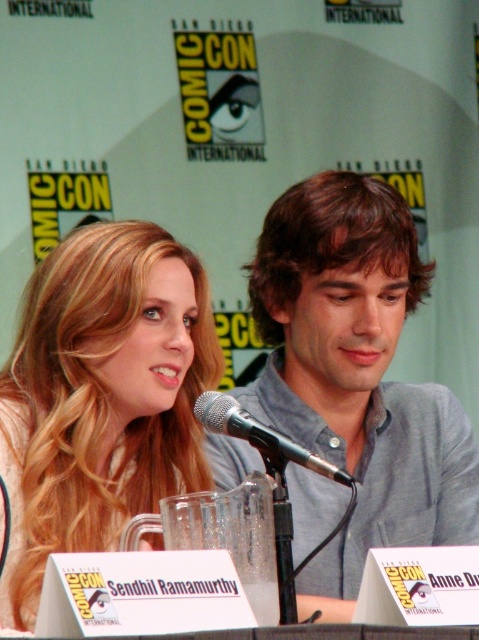
Which is more to the left, blonde hair at upper left or silver metallic microphone at center?

Positioned to the left is blonde hair at upper left.

Does point (52, 538) come closer to viewer compared to point (314, 458)?

That is False.

Locate an element on the screen. blonde hair at upper left is located at coordinates (101, 396).

Does gray cotton shirt at center appear over silver metallic microphone at center?

Yes.

Can you confirm if gray cotton shirt at center is thinner than silver metallic microphone at center?

No, gray cotton shirt at center is not thinner than silver metallic microphone at center.

Is point (390, 244) less distant than point (219, 417)?

No, (390, 244) is behind (219, 417).

Identify the location of gray cotton shirt at center. (356, 376).

Based on the photo, does gray cotton shirt at center have a greater height compared to blonde hair at upper left?

Yes, gray cotton shirt at center is taller than blonde hair at upper left.

Is gray cotton shirt at center to the left of blonde hair at upper left from the viewer's perspective?

No, gray cotton shirt at center is not to the left of blonde hair at upper left.

Identify the location of gray cotton shirt at center. (356, 376).

Locate an element on the screen. The width and height of the screenshot is (479, 640). gray cotton shirt at center is located at coordinates (356, 376).